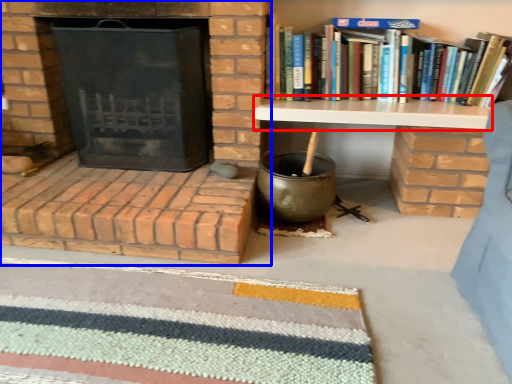
Question: Which object is closer to the camera taking this photo, table (highlighted by a red box) or fireplace (highlighted by a blue box)?

Choices:
 (A) table
 (B) fireplace

Answer: (B)